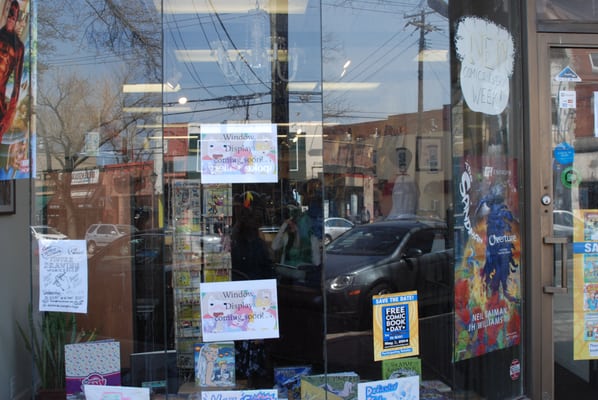
At what (x,y) coordinates should I click in order to perform the action: click on fluorescent light. Please return your answer as a coordinate pair (x, y). Image resolution: width=598 pixels, height=400 pixels. Looking at the image, I should click on (432, 55), (327, 85), (196, 52), (154, 87), (150, 110), (151, 125), (155, 137), (313, 136), (311, 123).